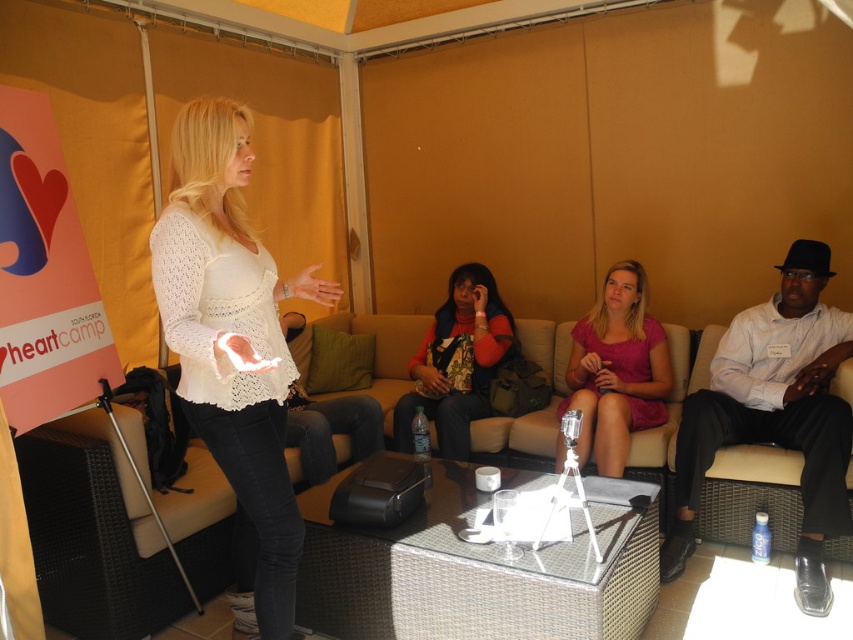
Is point (602, 458) closer to camera compared to point (427, 355)?

Yes, point (602, 458) is closer to viewer.

I want to click on pink fabric dress at center, so click(x=618, y=369).

Find the location of a particular element. The image size is (853, 640). pink fabric dress at center is located at coordinates (618, 369).

Measure the distance from beige wicker couch at center to white lace top at center.

beige wicker couch at center and white lace top at center are 30.42 inches apart from each other.

Is beige wicker couch at center in front of white lace top at center?

No, beige wicker couch at center is behind white lace top at center.

Which is behind, point (111, 596) or point (242, 144)?

The point (111, 596) is behind.

The image size is (853, 640). What are the coordinates of `beige wicker couch at center` in the screenshot? It's located at (94, 534).

Can you confirm if beige wicker couch at center is positioned to the left of white shirt at center?

Indeed, beige wicker couch at center is positioned on the left side of white shirt at center.

Is beige wicker couch at center shorter than white shirt at center?

Correct, beige wicker couch at center is not as tall as white shirt at center.

I want to click on beige wicker couch at center, so click(x=94, y=534).